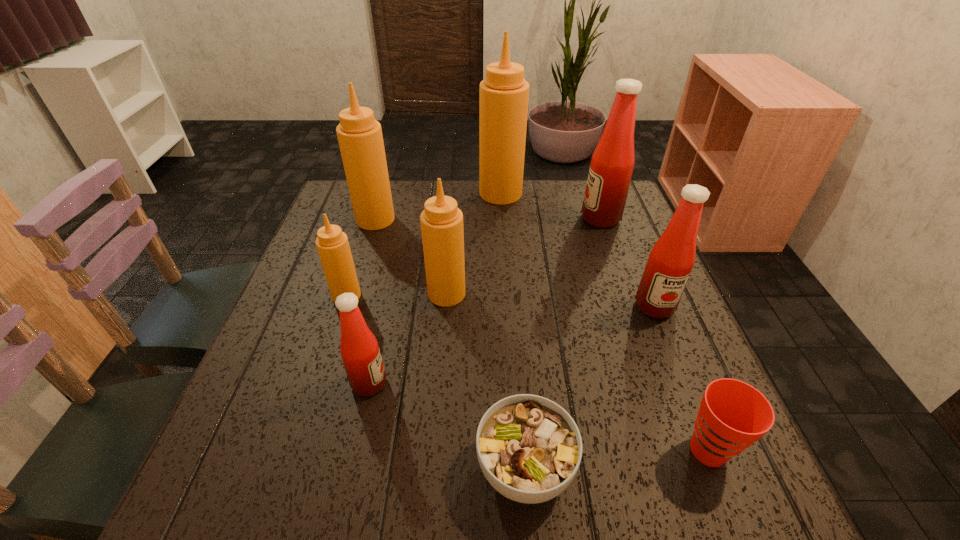
Where is `free spot between the second tan condiment from right to left and the second biggest tan condiment`? The image size is (960, 540). free spot between the second tan condiment from right to left and the second biggest tan condiment is located at coordinates [411, 256].

Identify the location of free space that is in between the biggest red condiment and the cup. Image resolution: width=960 pixels, height=540 pixels. (655, 334).

The image size is (960, 540). I want to click on vacant area between the fourth condiment from right to left and the nearest red condiment, so click(408, 339).

Identify which object is the eighth closest to the seventh farthest object. Please provide its 2D coordinates. Your answer should be formatted as a tuple, i.e. [(x, y)], where the tuple contains the x and y coordinates of a point satisfying the conditions above.

[(612, 163)]

You are a GUI agent. You are given a task and a screenshot of the screen. Output one action in this format:
    pyautogui.click(x=<x>, y=<y>)
    Task: Click on the object that is the closest to the fourth condiment from right to left
    Image resolution: width=960 pixels, height=540 pixels.
    Given the screenshot: What is the action you would take?
    pyautogui.click(x=332, y=244)

You are a GUI agent. You are given a task and a screenshot of the screen. Output one action in this format:
    pyautogui.click(x=<x>, y=<y>)
    Task: Click on the condiment that is the third nearest to the smallest tan condiment
    The width and height of the screenshot is (960, 540).
    Given the screenshot: What is the action you would take?
    pyautogui.click(x=360, y=138)

Locate an element on the screen. The image size is (960, 540). condiment that is the third closest to the third condiment from right to left is located at coordinates (442, 230).

Locate which tan condiment is the closest to the second shortest object. Please provide its 2D coordinates. Your answer should be formatted as a tuple, i.e. [(x, y)], where the tuple contains the x and y coordinates of a point satisfying the conditions above.

[(442, 230)]

Identify the location of tan condiment that can be found as the third closest to the cup. The width and height of the screenshot is (960, 540). (504, 93).

At what (x,y) coordinates should I click in order to perform the action: click on red condiment that stands as the closest to the farthest red condiment. Please return your answer as a coordinate pair (x, y). This screenshot has width=960, height=540. Looking at the image, I should click on (671, 260).